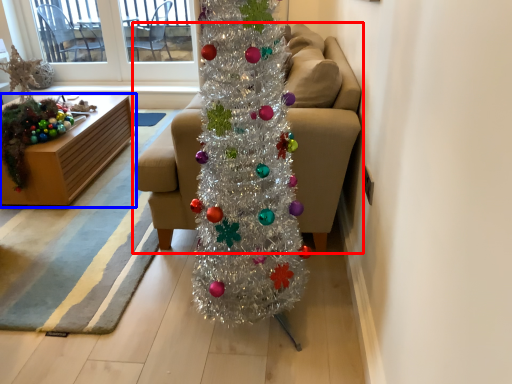
Question: Among these objects, which one is farthest to the camera, studio couch (highlighted by a red box) or furniture (highlighted by a blue box)?

Choices:
 (A) studio couch
 (B) furniture

Answer: (B)